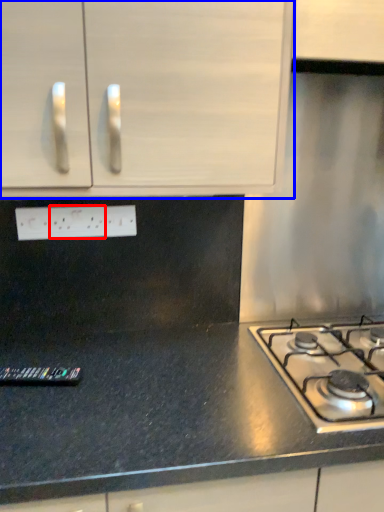
Question: Among these objects, which one is nearest to the camera, electric outlet (highlighted by a red box) or cabinetry (highlighted by a blue box)?

Choices:
 (A) electric outlet
 (B) cabinetry

Answer: (B)